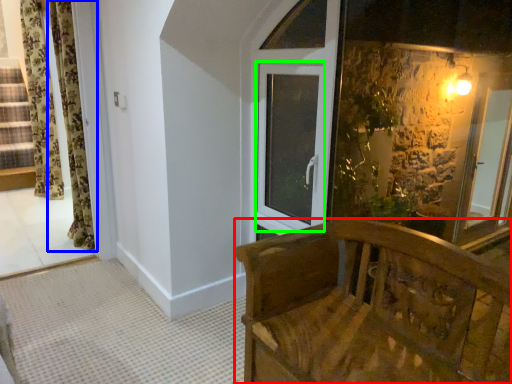
Question: Estimate the real-world distances between objects in this image. Which object is farther from furniture (highlighted by a red box), curtain (highlighted by a blue box) or window (highlighted by a green box)?

Choices:
 (A) curtain
 (B) window

Answer: (A)